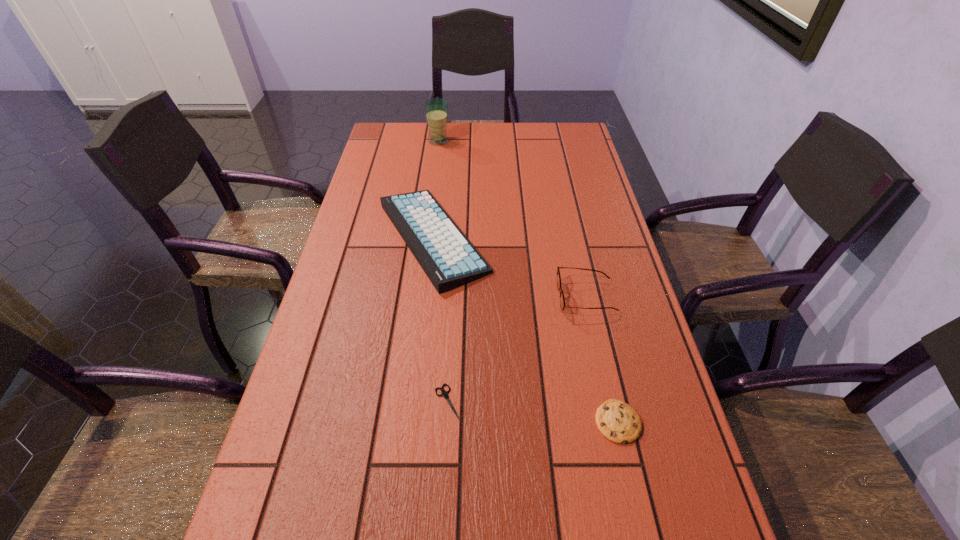
Image resolution: width=960 pixels, height=540 pixels. In order to click on free space that is in between the shears and the cookie in this screenshot , I will do `click(533, 412)`.

I want to click on free space between the shears and the fourth tallest object, so click(533, 412).

Identify the location of the third closest object to the fourth tallest object. (448, 258).

I want to click on the second closest object relative to the spectacles, so click(x=617, y=421).

The height and width of the screenshot is (540, 960). In order to click on vacant space that satisfies the following two spatial constraints: 1. on the back side of the fourth tallest object; 2. on the face of the spectacles in this screenshot , I will do `click(589, 297)`.

Locate an element on the screen. free space that satisfies the following two spatial constraints: 1. on the face of the spectacles; 2. on the right side of the second shortest object is located at coordinates (613, 422).

Find the location of a particular element. vacant space that satisfies the following two spatial constraints: 1. on the front side of the shortest object; 2. on the left side of the computer keyboard is located at coordinates (415, 402).

Where is `blank area in the image that satisfies the following two spatial constraints: 1. on the face of the cookie; 2. on the left side of the spectacles`? Image resolution: width=960 pixels, height=540 pixels. blank area in the image that satisfies the following two spatial constraints: 1. on the face of the cookie; 2. on the left side of the spectacles is located at coordinates (613, 422).